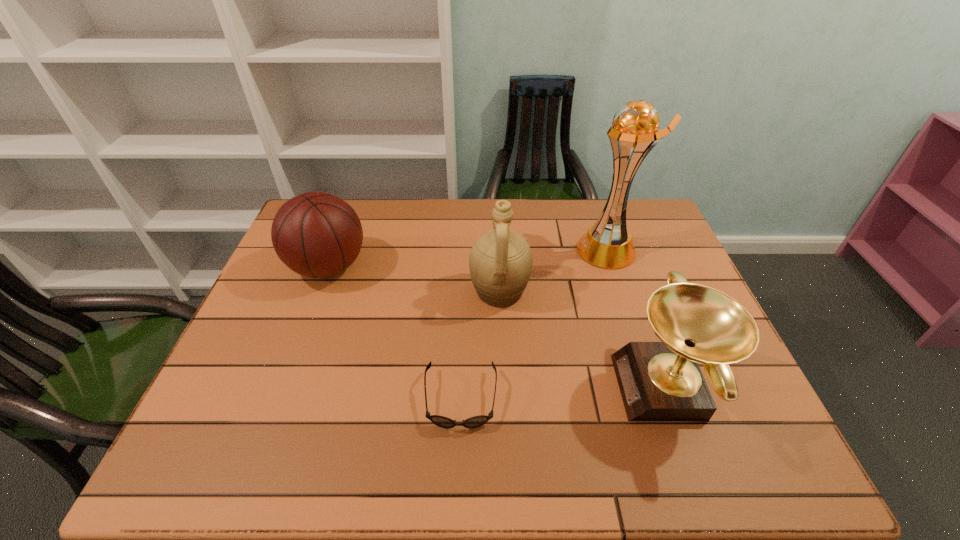
Identify the location of free space located on the front-facing side of the award. This screenshot has height=540, width=960. (593, 388).

The width and height of the screenshot is (960, 540). Identify the location of vacant space located 0.370m on the front-facing side of the award. (459, 388).

The height and width of the screenshot is (540, 960). In order to click on free space located 0.130m on the front-facing side of the award in this screenshot , I will do `click(563, 388)`.

Locate an element on the screen. The image size is (960, 540). object that is at the far edge is located at coordinates (608, 243).

Where is `object situated at the near edge`? The height and width of the screenshot is (540, 960). object situated at the near edge is located at coordinates tap(659, 381).

You are a GUI agent. You are given a task and a screenshot of the screen. Output one action in this format:
    pyautogui.click(x=<x>, y=<y>)
    Task: Click on the object at the left edge
    This screenshot has width=960, height=540.
    Given the screenshot: What is the action you would take?
    pyautogui.click(x=316, y=234)

Locate an element on the screen. trophy situated at the right edge is located at coordinates point(608,243).

The height and width of the screenshot is (540, 960). Identify the location of award positioned at the right edge. (659, 381).

In order to click on object that is positioned at the far right corner in this screenshot , I will do `click(608, 243)`.

Locate an element on the screen. object present at the near right corner is located at coordinates (659, 381).